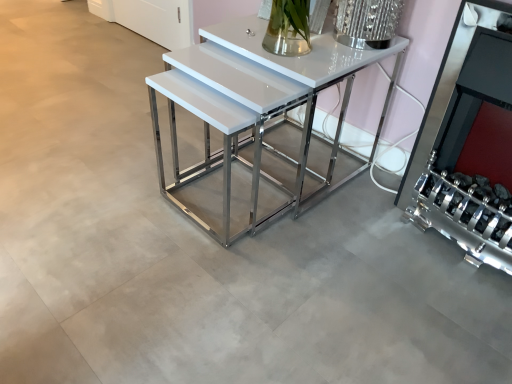
Question: Does silver metallic fireplace at right touch white glossy table at center?

Choices:
 (A) no
 (B) yes

Answer: (A)

Question: Does silver metallic fireplace at right have a larger size compared to white glossy table at center?

Choices:
 (A) no
 (B) yes

Answer: (A)

Question: From a real-world perspective, is silver metallic fireplace at right on top of white glossy table at center?

Choices:
 (A) no
 (B) yes

Answer: (B)

Question: From a real-world perspective, is silver metallic fireplace at right physically below white glossy table at center?

Choices:
 (A) yes
 (B) no

Answer: (B)

Question: Does silver metallic fireplace at right turn towards white glossy table at center?

Choices:
 (A) yes
 (B) no

Answer: (B)

Question: Does silver metallic fireplace at right appear on the left side of white glossy table at center?

Choices:
 (A) no
 (B) yes

Answer: (A)

Question: From a real-world perspective, is white glossy table at center positioned under silver metallic fireplace at right based on gravity?

Choices:
 (A) no
 (B) yes

Answer: (B)

Question: Is white glossy table at center positioned with its back to silver metallic fireplace at right?

Choices:
 (A) yes
 (B) no

Answer: (B)

Question: Is white glossy table at center closer to the viewer compared to silver metallic fireplace at right?

Choices:
 (A) no
 (B) yes

Answer: (A)

Question: Is white glossy table at center taller than silver metallic fireplace at right?

Choices:
 (A) yes
 (B) no

Answer: (B)

Question: From the image's perspective, is white glossy table at center above silver metallic fireplace at right?

Choices:
 (A) no
 (B) yes

Answer: (B)

Question: Is white glossy table at center far from silver metallic fireplace at right?

Choices:
 (A) yes
 (B) no

Answer: (B)

Question: From the image's perspective, is white glossy table at center located above or below silver metallic fireplace at right?

Choices:
 (A) above
 (B) below

Answer: (A)